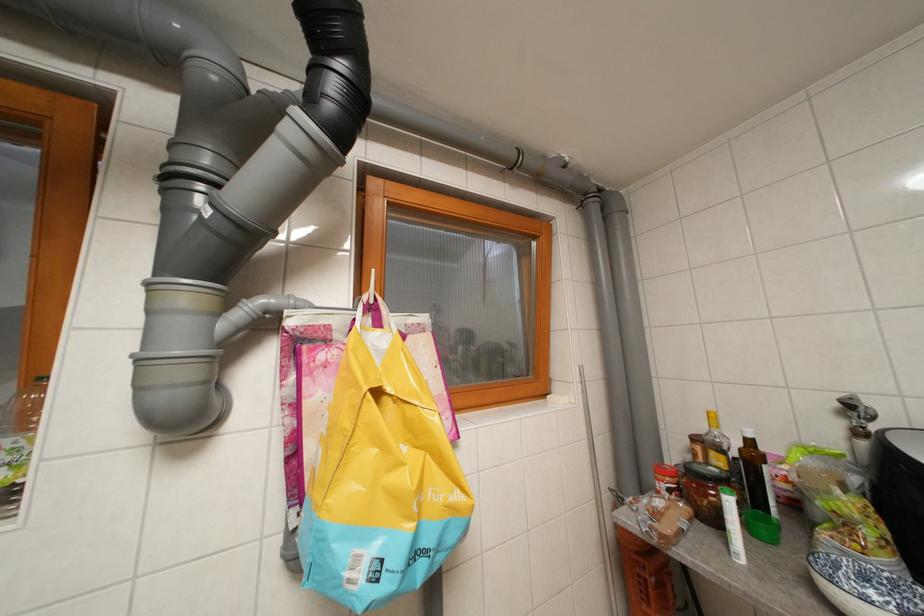
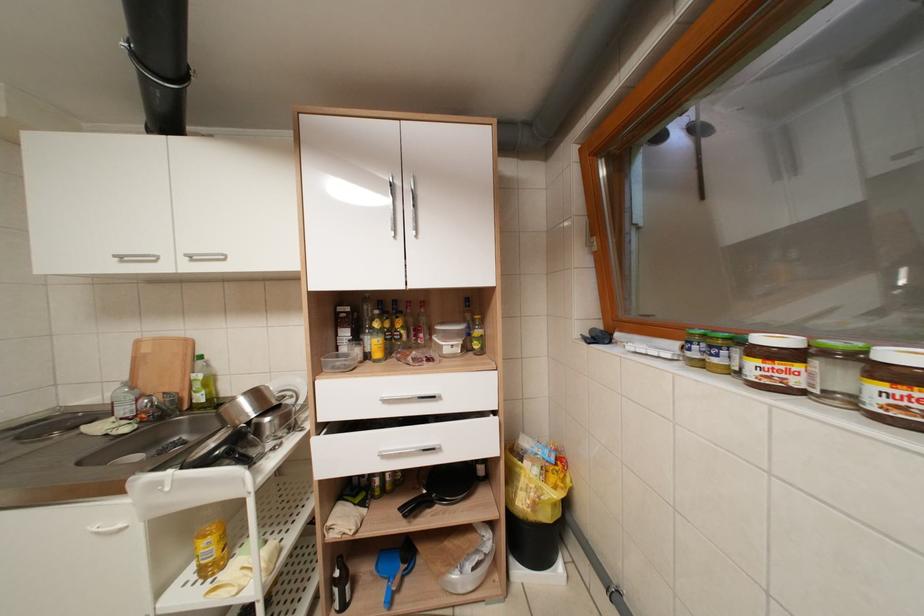
Question: How did the camera likely rotate?

Choices:
 (A) Left
 (B) Right
 (C) Up
 (D) Down

Answer: (A)